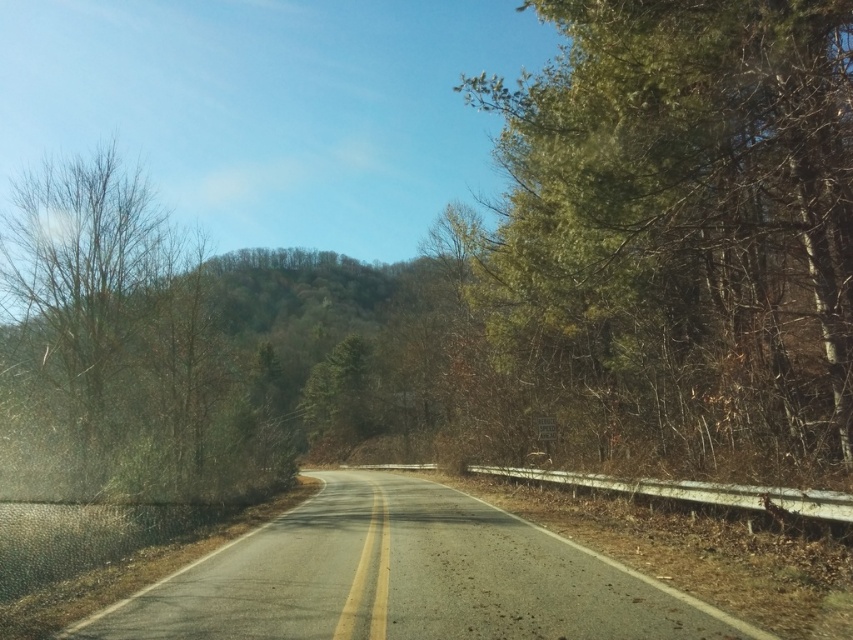
How much distance is there between asphalt road at center and bare branches at left?

8.20 meters

Which is in front, point (395, 563) or point (13, 291)?

Point (395, 563)

Where is `asphalt road at center`? This screenshot has width=853, height=640. asphalt road at center is located at coordinates click(405, 579).

Locate an element on the screen. This screenshot has height=640, width=853. asphalt road at center is located at coordinates (405, 579).

Is green leafy tree at right above bare branches at left?

Yes.

Locate an element on the screen. The image size is (853, 640). green leafy tree at right is located at coordinates [x=683, y=221].

Who is positioned more to the left, green leafy tree at right or asphalt road at center?

Positioned to the left is asphalt road at center.

Based on the photo, is green leafy tree at right to the left of asphalt road at center from the viewer's perspective?

Incorrect, green leafy tree at right is not on the left side of asphalt road at center.

Between point (769, 259) and point (448, 605), which one is positioned in front?

Point (448, 605)

At what (x,y) coordinates should I click in order to perform the action: click on green leafy tree at right. Please return your answer as a coordinate pair (x, y). This screenshot has height=640, width=853. Looking at the image, I should click on (683, 221).